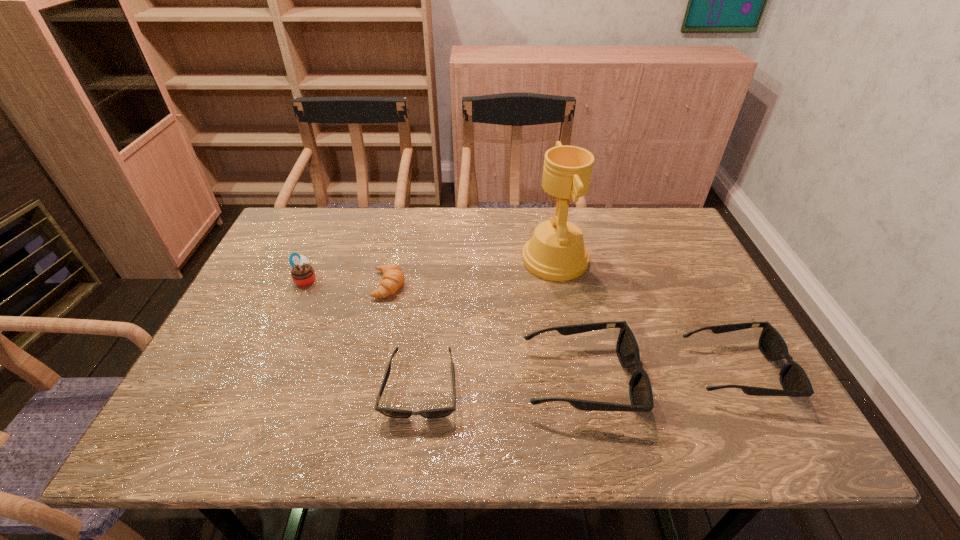
You are a GUI agent. You are given a task and a screenshot of the screen. Output one action in this format:
    pyautogui.click(x=<x>, y=<y>)
    Task: Click on the vacant region located 0.230m on the right of the crescent roll
    
    Given the screenshot: What is the action you would take?
    pyautogui.click(x=491, y=285)

Image resolution: width=960 pixels, height=540 pixels. I want to click on vacant space located on the back of the award, so click(x=548, y=224).

Identify the location of object that is at the far edge. (556, 252).

Identify the location of object that is at the left edge. (303, 274).

At what (x,y) coordinates should I click in order to perform the action: click on object that is at the right edge. Please return your answer as a coordinate pair (x, y). The image size is (960, 540). Looking at the image, I should click on (795, 383).

What are the coordinates of `object that is at the near right corner` in the screenshot? It's located at (795, 383).

Locate an element on the screen. This screenshot has height=540, width=960. vacant space at the far edge of the desktop is located at coordinates (584, 217).

The width and height of the screenshot is (960, 540). In the image, there is a desktop. Find the location of `vacant space at the near edge`. vacant space at the near edge is located at coordinates (520, 376).

Where is `vacant space at the left edge of the desktop`? This screenshot has height=540, width=960. vacant space at the left edge of the desktop is located at coordinates (253, 285).

At what (x,y) coordinates should I click in order to perform the action: click on vacant space at the right edge of the desktop. Please return your answer as a coordinate pair (x, y). This screenshot has height=540, width=960. Looking at the image, I should click on (721, 350).